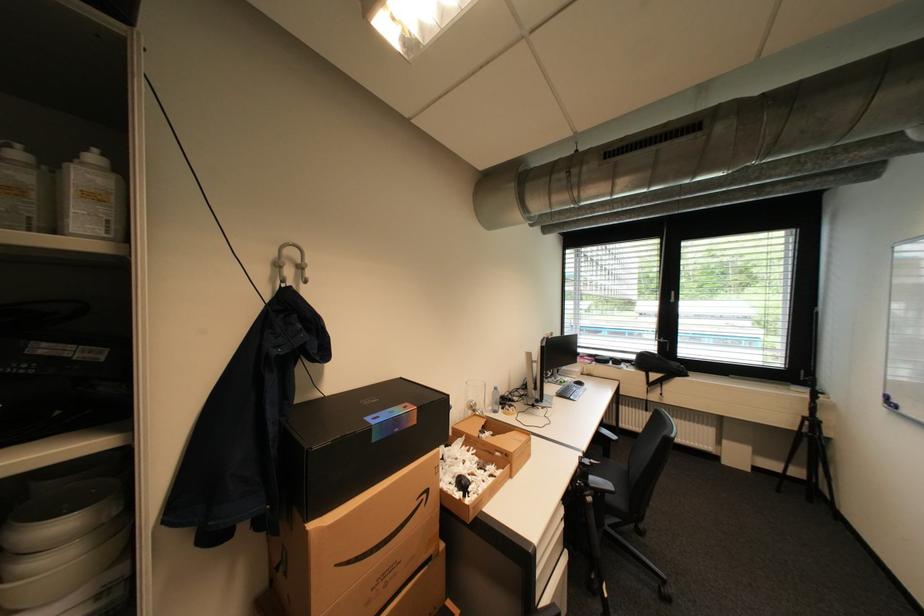
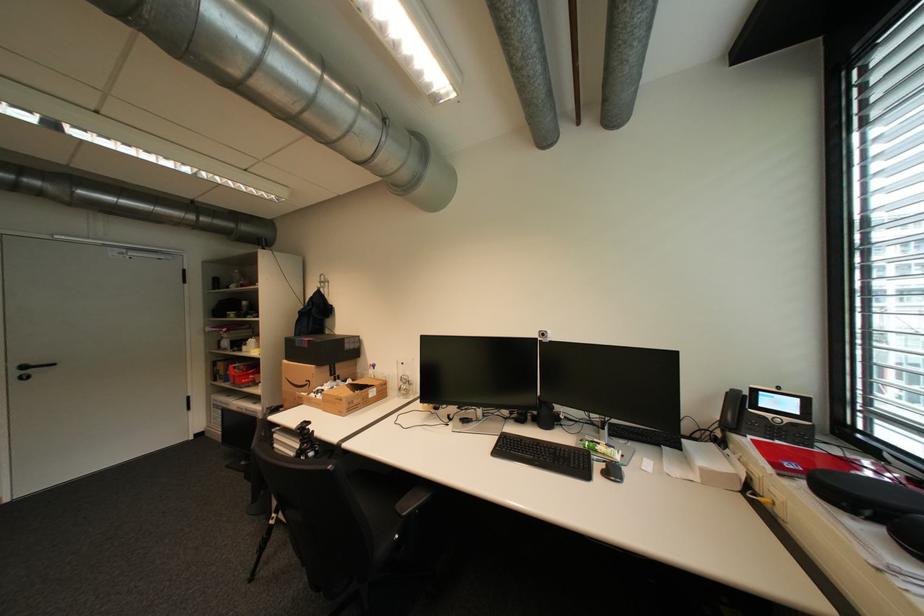
Locate, in the second image, the point that corresponds to point (433, 496) in the first image.

(317, 383)